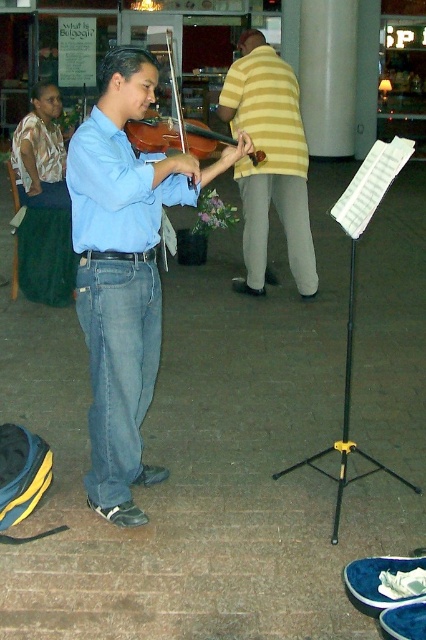
You are a photographer capturing the street performer. You notice the matte blue shirt at center and the wooden violin at center. Based on their positions, which object is closer to the right edge of your camera frame?

The matte blue shirt at center is to the right of the wooden violin at center, so it is closer to the right edge of the camera frame.

You are standing in the street performance scene and want to know which of the two points, point (129, 61) or point (143, 141), is closer to you. Can you determine this based on the scene?

Point (129, 61) is closer to the viewer than point (143, 141).